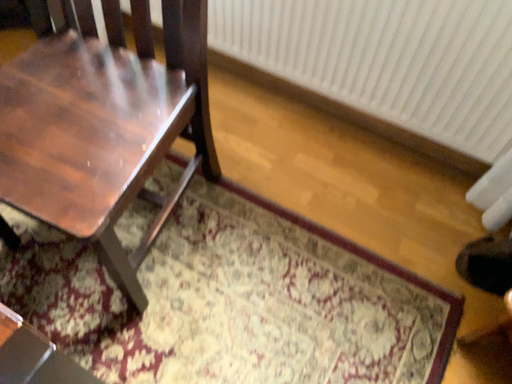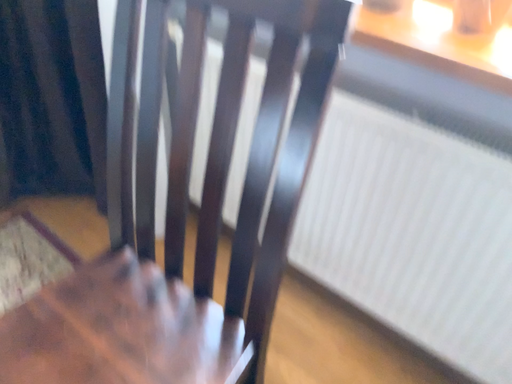
Question: Which way did the camera rotate in the video?

Choices:
 (A) rotated upward
 (B) rotated downward

Answer: (A)